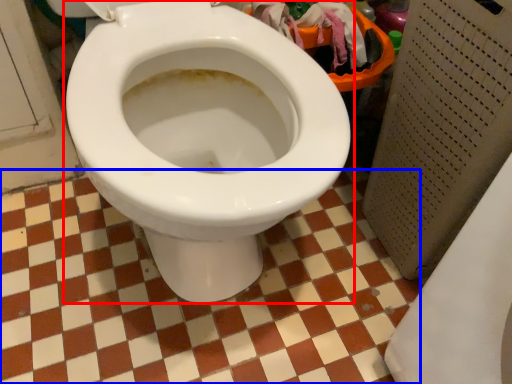
Question: Which object is closer to the camera taking this photo, toilet (highlighted by a red box) or ceramic tile (highlighted by a blue box)?

Choices:
 (A) toilet
 (B) ceramic tile

Answer: (A)